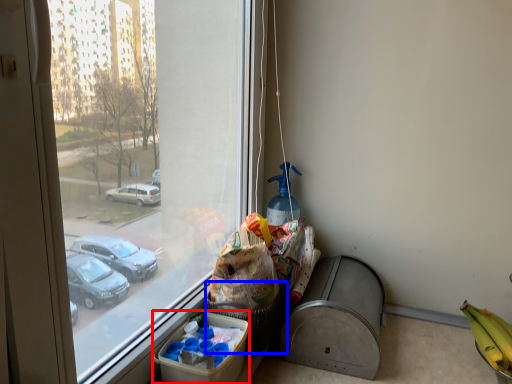
Question: Which object appears closest to the camera in this image, cardboard box (highlighted by a red box) or basket (highlighted by a blue box)?

Choices:
 (A) cardboard box
 (B) basket

Answer: (A)